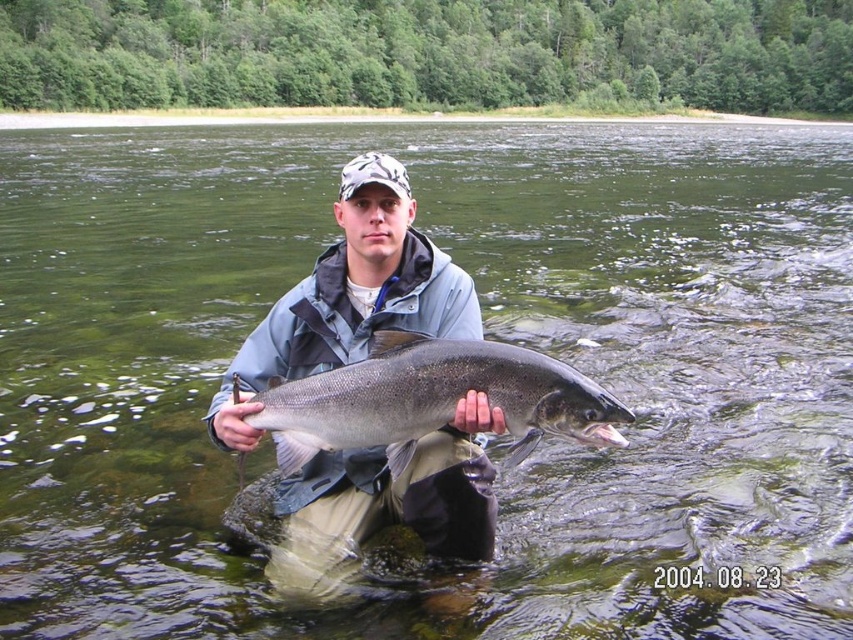
You are a wildlife photographer aiming to capture the largest fish in the river. You see the gray matte fish at center and the shiny silver fish at center. Which one should you focus on to photograph the bigger fish?

The gray matte fish at center is bigger than the shiny silver fish at center, so you should focus on the gray matte fish at center to photograph the bigger fish.

You are a wildlife researcher observing the river. You need to determine which fish is narrower between the gray matte fish at center and the shiny silver fish at center. Which one is it?

The gray matte fish at center has a lesser width compared to shiny silver fish at center, so the gray matte fish at center is narrower.